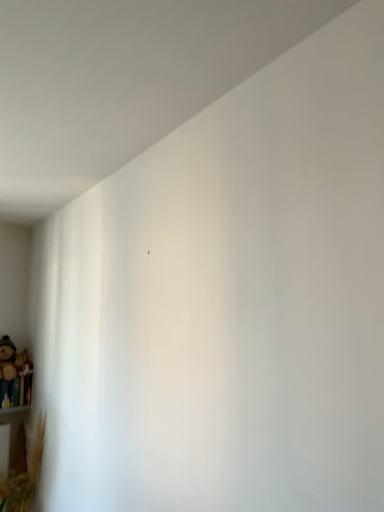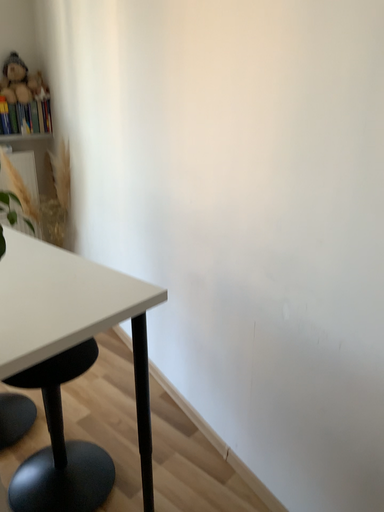
Question: Which way did the camera rotate in the video?

Choices:
 (A) rotated upward
 (B) rotated downward

Answer: (B)